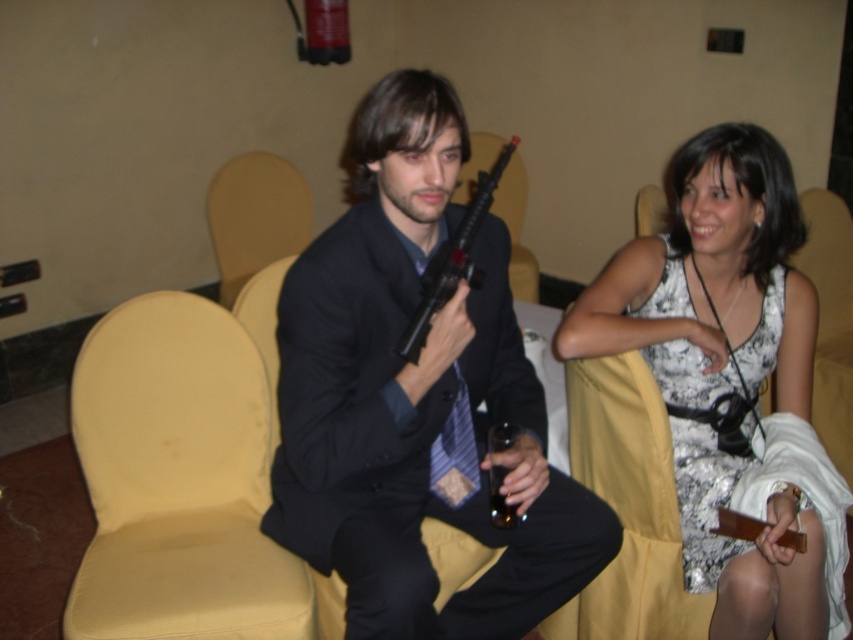
Is yellow fabric chair at left below black plastic gun at center?

Indeed, yellow fabric chair at left is positioned under black plastic gun at center.

Is point (236, 477) farther from camera compared to point (462, 269)?

Yes.

At what (x,y) coordinates should I click in order to perform the action: click on yellow fabric chair at left. Please return your answer as a coordinate pair (x, y). Looking at the image, I should click on (178, 481).

The width and height of the screenshot is (853, 640). In order to click on yellow fabric chair at left in this screenshot , I will do `click(178, 481)`.

Can you confirm if white floral dress at center is taller than white floral dress at right?

Correct, white floral dress at center is much taller as white floral dress at right.

Which of these two, white floral dress at center or white floral dress at right, stands taller?

white floral dress at center is taller.

This screenshot has width=853, height=640. What do you see at coordinates (732, 381) in the screenshot? I see `white floral dress at center` at bounding box center [732, 381].

Find the location of `white floral dress at center`. white floral dress at center is located at coordinates (732, 381).

Can you confirm if white floral dress at center is positioned to the right of black plastic gun at center?

Correct, you'll find white floral dress at center to the right of black plastic gun at center.

Which is behind, point (706, 577) or point (498, 156)?

Positioned behind is point (498, 156).

Is point (781, 285) closer to camera compared to point (436, 282)?

That is False.

Find the location of a particular element. The image size is (853, 640). white floral dress at center is located at coordinates (732, 381).